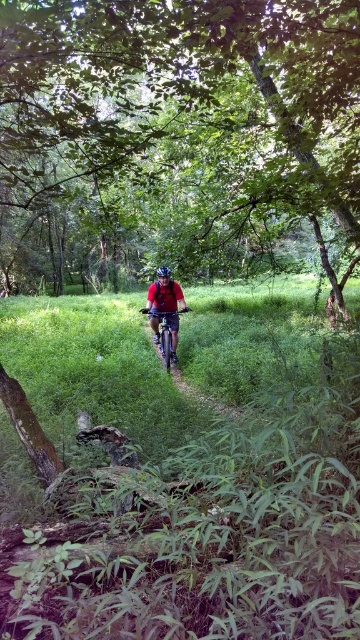
In the scene shown: You are standing at the camera position and want to take a photo of the green leafy tree at center. If your camera has a maximum focus distance of 10 feet, will it be able to focus on the tree?

The green leafy tree at center and camera are 8.93 feet apart from each other. Since the distance is within the camera maximum focus distance of 10 feet, the camera can focus on the green leafy tree at center.

You are a photographer aiming to capture the cyclist in the center of your photo. Given the coordinates of the matte red shirt at center, which is at point 0.483, 0.458, can you position your camera to frame the cyclist perfectly in the center?

The matte red shirt at center is located at coordinates [164,308], which is very close to the center of the frame. The photographer can adjust slightly to ensure the cyclist is centered.